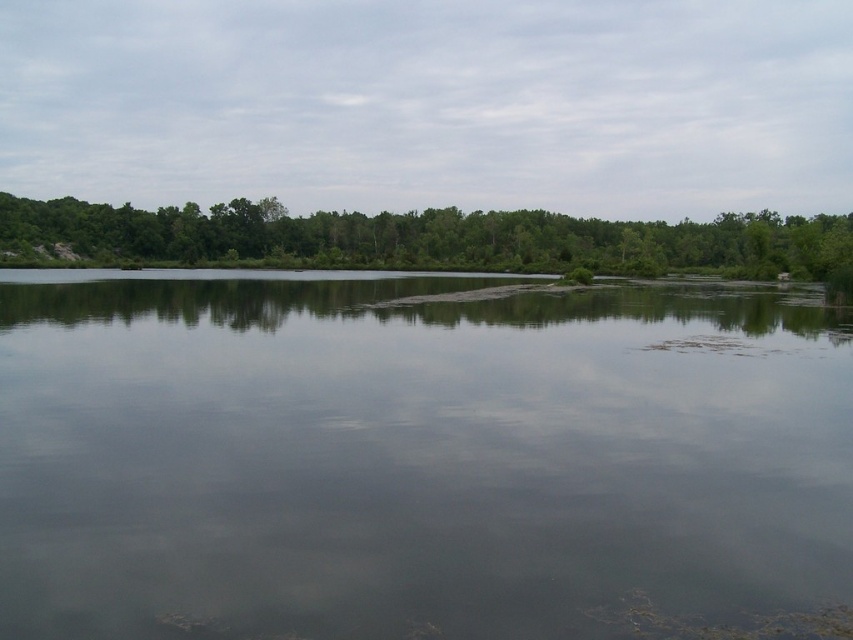
Question: Can you confirm if transparent water at center is positioned below green leafy trees at upper center?

Choices:
 (A) yes
 (B) no

Answer: (A)

Question: Is transparent water at center to the left of green leafy trees at upper center from the viewer's perspective?

Choices:
 (A) no
 (B) yes

Answer: (B)

Question: Can you confirm if transparent water at center is thinner than green leafy trees at upper center?

Choices:
 (A) yes
 (B) no

Answer: (A)

Question: Which point is farther to the camera?

Choices:
 (A) (569, 268)
 (B) (415, 547)

Answer: (A)